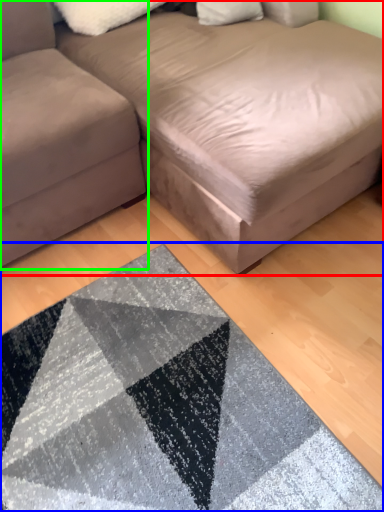
Question: Considering the real-world distances, which object is closest to studio couch (highlighted by a red box)? mat (highlighted by a blue box) or studio couch (highlighted by a green box).

Choices:
 (A) mat
 (B) studio couch

Answer: (B)